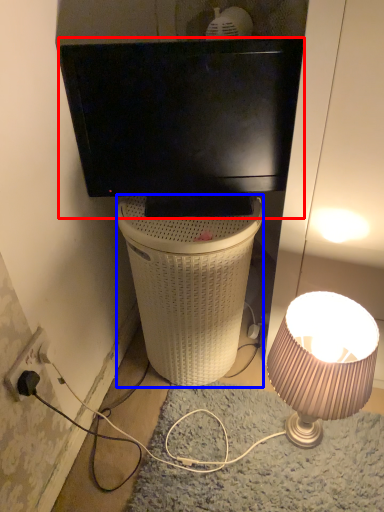
Question: Which object is closer to the camera taking this photo, television (highlighted by a red box) or trash bin/can (highlighted by a blue box)?

Choices:
 (A) television
 (B) trash bin/can

Answer: (A)